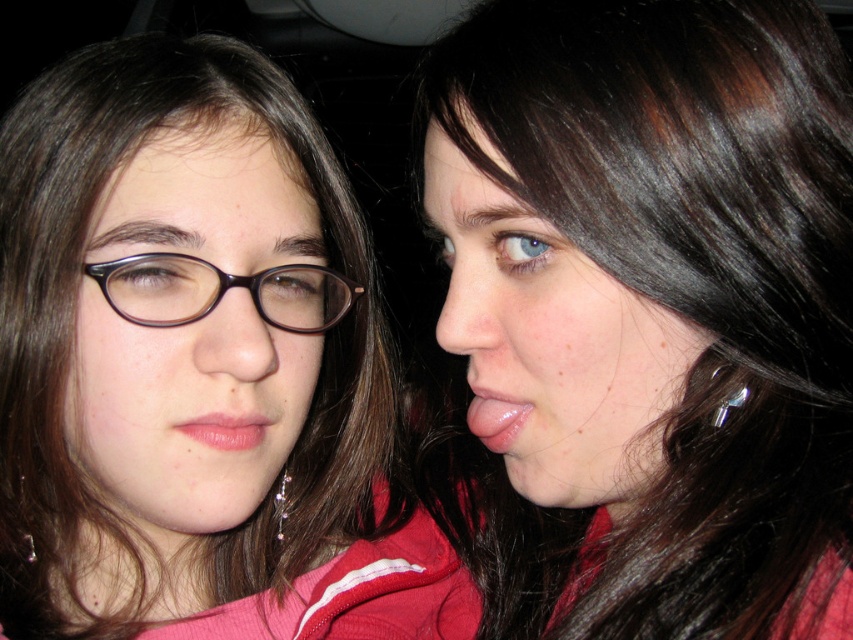
You are a photographer adjusting a camera in a dimly lit room. You notice a point at coordinates (x=653, y=308). Based on the scene description, where is this point located?

The point at coordinates (x=653, y=308) is located on the smooth skin face at center.